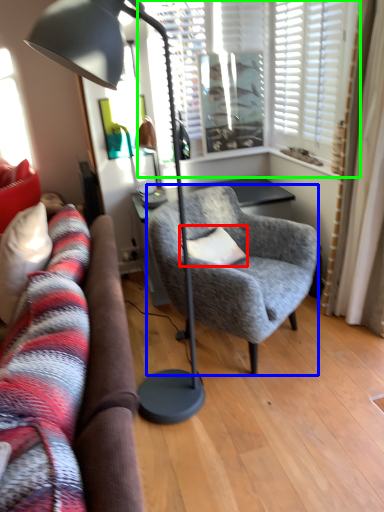
Question: Based on their relative distances, which object is farther from pillow (highlighted by a red box)? Choose from chair (highlighted by a blue box) and window (highlighted by a green box).

Choices:
 (A) chair
 (B) window

Answer: (B)